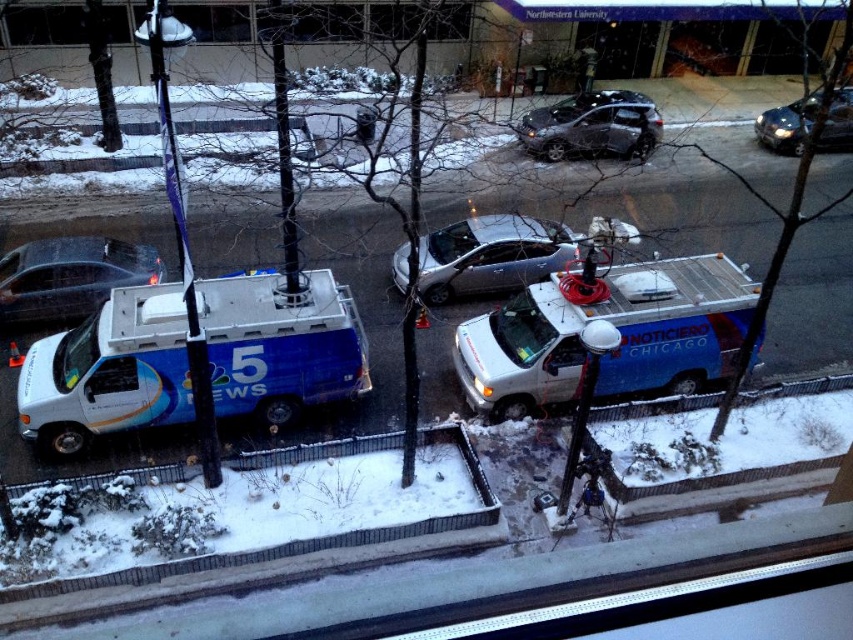
Question: Among these objects, which one is nearest to the camera?

Choices:
 (A) silver metallic car at center
 (B) satin black sedan at upper center
 (C) white glossy van at left
 (D) blue metallic van at center

Answer: (D)

Question: Is white glossy van at center above satin black sedan at upper center?

Choices:
 (A) no
 (B) yes

Answer: (A)

Question: Which of these objects is positioned farthest from the shiny black sedan at upper right?

Choices:
 (A) transparent glass window at upper center
 (B) white glossy van at center
 (C) satin black sedan at upper center

Answer: (B)

Question: Which object is farther from the camera taking this photo?

Choices:
 (A) blue metallic van at center
 (B) white glossy van at center
 (C) white glossy van at left

Answer: (C)

Question: Is white glossy van at left above shiny black sedan at upper right?

Choices:
 (A) yes
 (B) no

Answer: (B)

Question: Is silver metallic car at center in front of shiny black sedan at upper right?

Choices:
 (A) no
 (B) yes

Answer: (A)